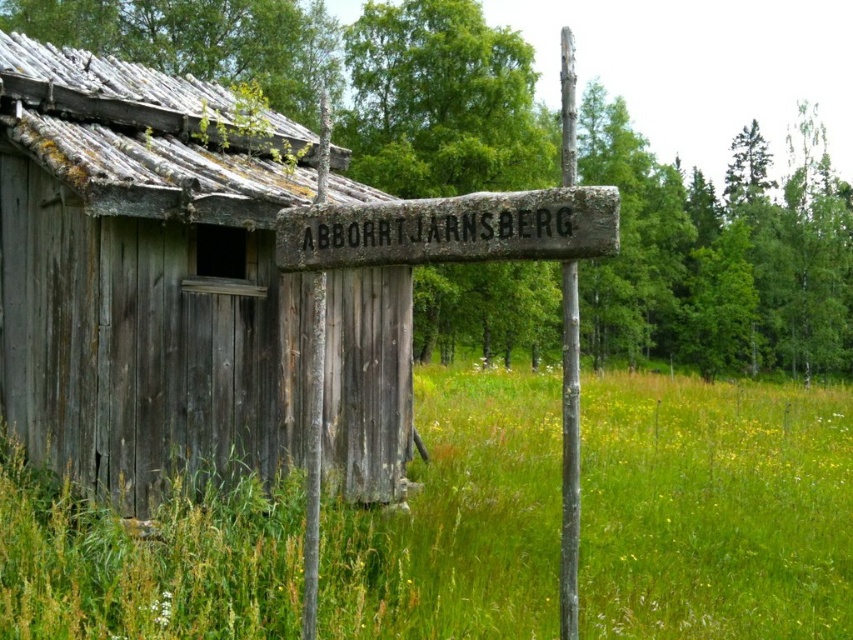
Question: Among these points, which one is farthest from the camera?

Choices:
 (A) [x=672, y=531]
 (B) [x=30, y=51]

Answer: (B)

Question: Does green grassy field at center appear over weathered wood sign at center?

Choices:
 (A) yes
 (B) no

Answer: (B)

Question: Among these objects, which one is farthest from the camera?

Choices:
 (A) green grassy field at center
 (B) weathered wood sign at center
 (C) weathered wood hut at center

Answer: (C)

Question: Is weathered wood hut at center positioned before weathered wood sign at center?

Choices:
 (A) no
 (B) yes

Answer: (A)

Question: Which of the following is the farthest from the observer?

Choices:
 (A) (357, 221)
 (B) (582, 557)
 (C) (238, 266)

Answer: (C)

Question: Is green grassy field at center thinner than weathered wood sign at center?

Choices:
 (A) no
 (B) yes

Answer: (A)